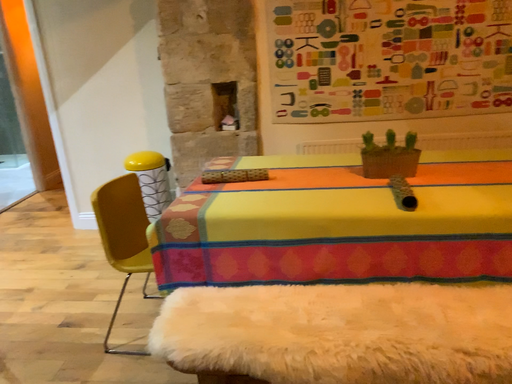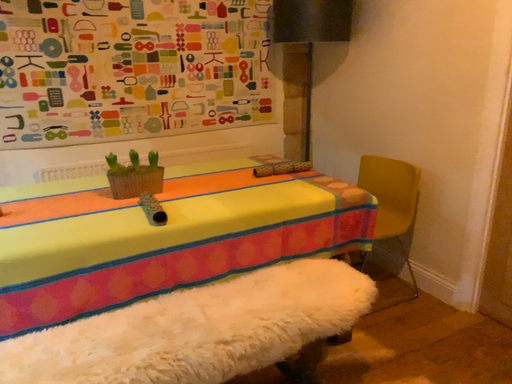
Question: How did the camera likely rotate when shooting the video?

Choices:
 (A) rotated right
 (B) rotated left

Answer: (A)